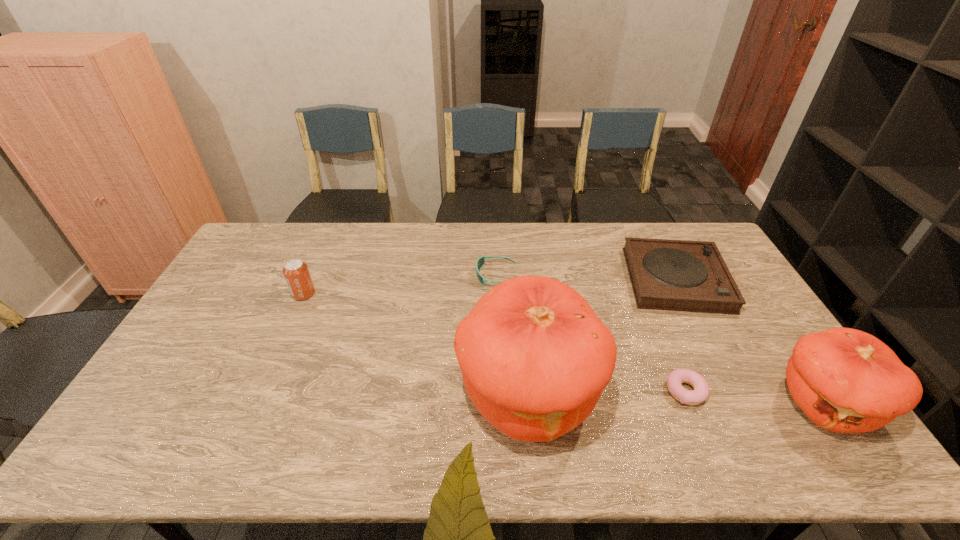
Where is `the taller pumpkin`? This screenshot has width=960, height=540. the taller pumpkin is located at coordinates (535, 358).

This screenshot has width=960, height=540. What are the coordinates of `the tallest object` in the screenshot? It's located at tap(535, 358).

At what (x,y) coordinates should I click in order to perform the action: click on the fifth shortest object. Please return your answer as a coordinate pair (x, y). Looking at the image, I should click on (845, 380).

Identify the location of the right pumpkin. (845, 380).

Identify the location of the leftmost object. The image size is (960, 540). (296, 272).

This screenshot has width=960, height=540. Find the location of `the fourth shortest object`. the fourth shortest object is located at coordinates (296, 272).

Locate an element on the screen. the fifth tallest object is located at coordinates (480, 262).

This screenshot has width=960, height=540. Identify the location of phonograph record. (676, 275).

Locate an element on the screen. The height and width of the screenshot is (540, 960). the shortest object is located at coordinates (675, 379).

The width and height of the screenshot is (960, 540). In order to click on vacant point located on the back of the tallest object in this screenshot , I will do `click(518, 296)`.